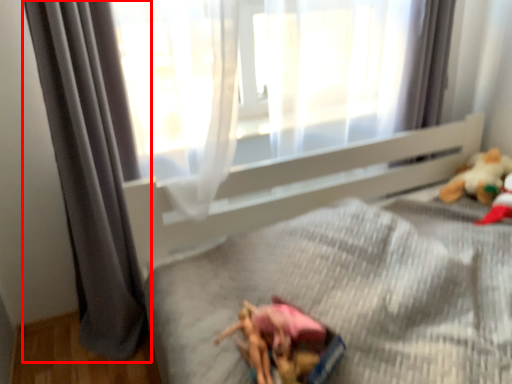
Question: Where is curtain (annotated by the red box) located in relation to toy in the image?

Choices:
 (A) right
 (B) left

Answer: (B)